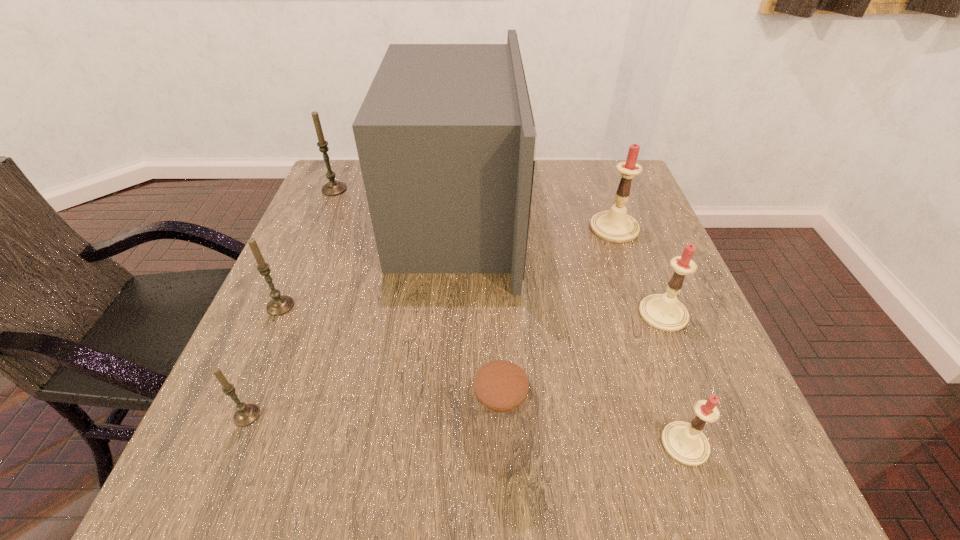
Locate an element on the screen. This screenshot has height=540, width=960. the nearest red candle is located at coordinates (685, 442).

The height and width of the screenshot is (540, 960). I want to click on free location located 0.320m on the front-facing side of the tallest object, so click(642, 215).

The height and width of the screenshot is (540, 960). I want to click on vacant area situated 0.120m on the right of the farthest gray candle, so click(x=390, y=190).

What are the coordinates of `free region located 0.400m on the left of the farthest red candle` in the screenshot? It's located at (429, 228).

The width and height of the screenshot is (960, 540). Identify the location of vacant space located on the front of the second nearest red candle. (726, 472).

Identify the location of free space located on the right of the second biggest gray candle. This screenshot has width=960, height=540. (381, 306).

The height and width of the screenshot is (540, 960). I want to click on blank area located on the right of the brown jar, so click(627, 444).

Where is `vacant region located on the back of the nearest gray candle`? The height and width of the screenshot is (540, 960). vacant region located on the back of the nearest gray candle is located at coordinates (306, 272).

The image size is (960, 540). Identify the location of free location located on the back of the nearest red candle. (624, 267).

This screenshot has height=540, width=960. Find the location of `microwave oven that is positioned at the far edge`. microwave oven that is positioned at the far edge is located at coordinates (446, 139).